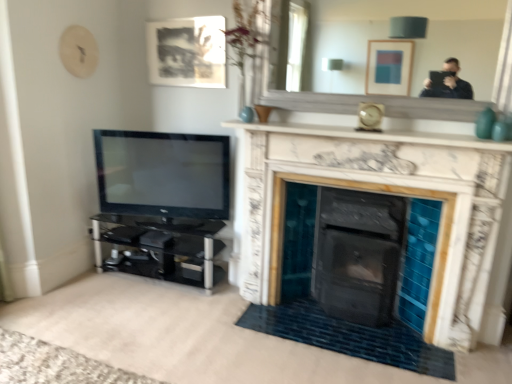
Locate an element on the screen. free space below white marble mirror at upper center (from a real-world perspective) is located at coordinates (391, 126).